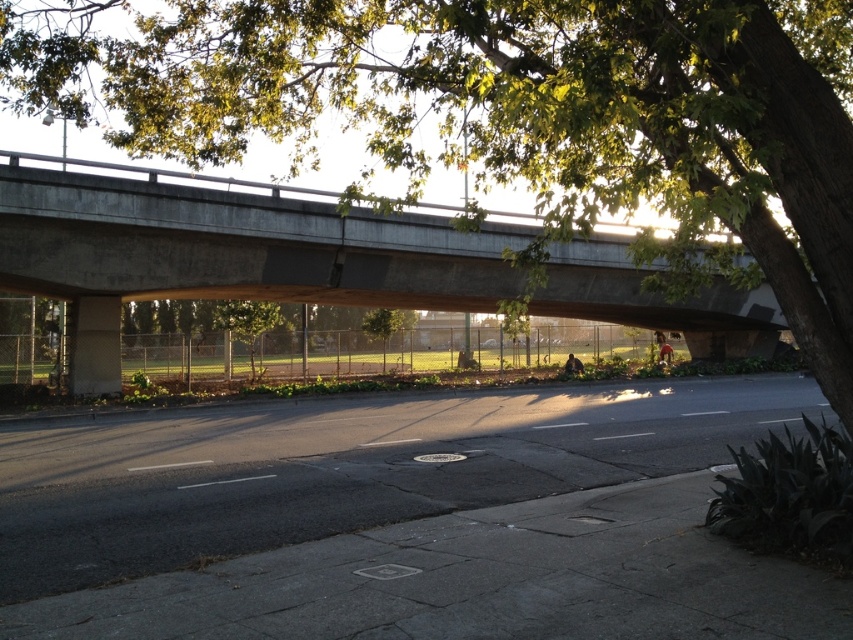
Question: Which object is closer to the camera taking this photo?

Choices:
 (A) black asphalt highway at center
 (B) green leafy tree at upper center
 (C) concrete bridge at upper center

Answer: (B)

Question: Which object is closer to the camera taking this photo?

Choices:
 (A) concrete bridge at upper center
 (B) black asphalt highway at center

Answer: (B)

Question: In this image, where is green leafy tree at upper center located relative to black asphalt highway at center?

Choices:
 (A) left
 (B) right

Answer: (A)

Question: Can you confirm if black asphalt highway at center is positioned above concrete bridge at upper center?

Choices:
 (A) no
 (B) yes

Answer: (A)

Question: Is black asphalt highway at center bigger than concrete bridge at upper center?

Choices:
 (A) no
 (B) yes

Answer: (A)

Question: Which point appears farthest from the camera in this image?

Choices:
 (A) (689, 250)
 (B) (706, 316)

Answer: (B)